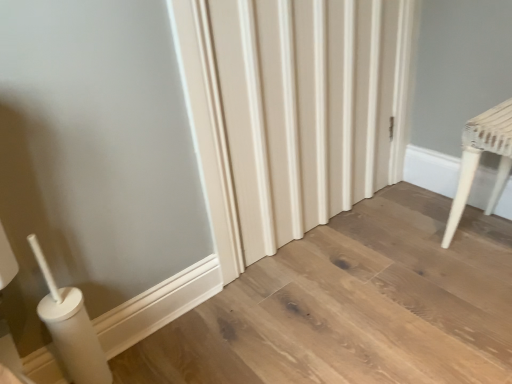
What are the coordinates of `free spot behind white woven stool at right` in the screenshot? It's located at (439, 206).